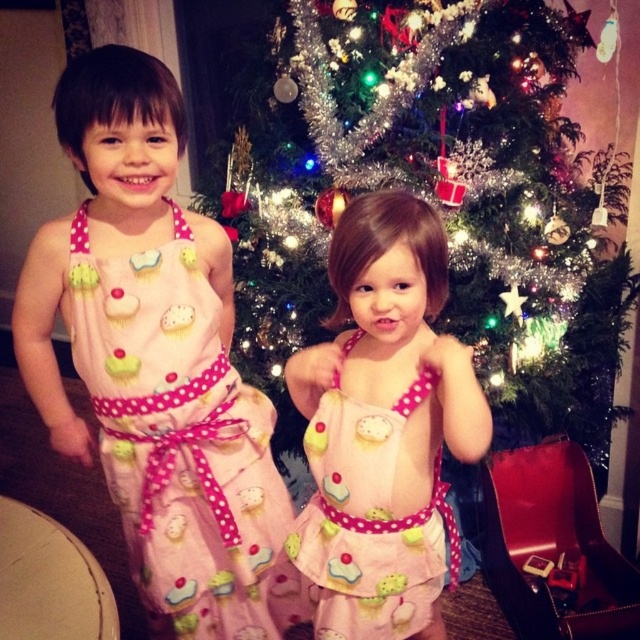
Question: Among these objects, which one is nearest to the camera?

Choices:
 (A) shiny tinsel christmas tree at center
 (B) pink polka dot fabric dress at center
 (C) pink polka dot dress at center

Answer: (C)

Question: Considering the relative positions of shiny tinsel christmas tree at center and pink polka dot fabric dress at center in the image provided, where is shiny tinsel christmas tree at center located with respect to pink polka dot fabric dress at center?

Choices:
 (A) below
 (B) above

Answer: (B)

Question: Can you confirm if shiny tinsel christmas tree at center is smaller than pink polka dot dress at center?

Choices:
 (A) no
 (B) yes

Answer: (A)

Question: Which object is farther from the camera taking this photo?

Choices:
 (A) pink polka dot dress at center
 (B) pink polka dot fabric dress at center

Answer: (B)

Question: Which object is the closest to the pink polka dot dress at center?

Choices:
 (A) pink polka dot fabric dress at center
 (B) shiny tinsel christmas tree at center

Answer: (A)

Question: Can you confirm if pink polka dot fabric dress at center is wider than pink polka dot dress at center?

Choices:
 (A) no
 (B) yes

Answer: (B)